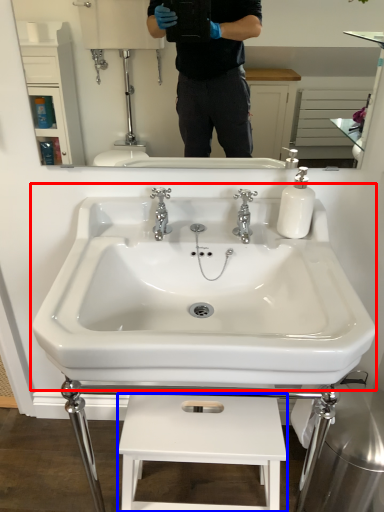
Question: Which point is further to the camera, sink (highlighted by a red box) or lift (highlighted by a blue box)?

Choices:
 (A) sink
 (B) lift

Answer: (B)